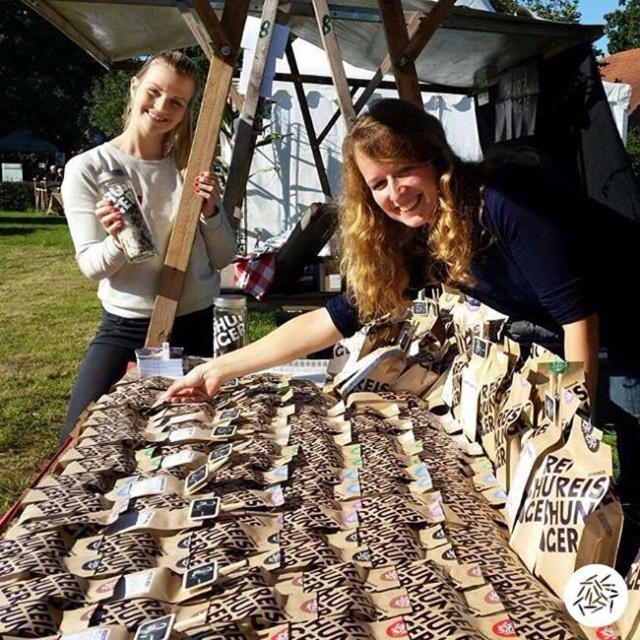
Is brown paper bags at center shorter than brown paper bag at center?

In fact, brown paper bags at center may be taller than brown paper bag at center.

Consider the image. Who is positioned more to the right, brown paper bags at center or brown paper bag at center?

brown paper bags at center is more to the right.

What are the coordinates of `brown paper bags at center` in the screenshot? It's located at (300, 522).

Does matte white sweater at upper left have a larger size compared to brown paper bag at center?

Yes.

Which is more to the left, matte white sweater at upper left or brown paper bag at center?

From the viewer's perspective, matte white sweater at upper left appears more on the left side.

Is point (157, 129) positioned in front of point (289, 346)?

No, (157, 129) is behind (289, 346).

Where is `matte white sweater at upper left`? matte white sweater at upper left is located at coordinates (120, 221).

Is brown paper bags at center closer to the viewer compared to matte white sweater at upper left?

Yes, it is in front of matte white sweater at upper left.

Who is taller, brown paper bags at center or matte white sweater at upper left?

matte white sweater at upper left

Between point (44, 545) and point (163, 129), which one is positioned in front?

Point (44, 545) is in front.

I want to click on brown paper bags at center, so click(300, 522).